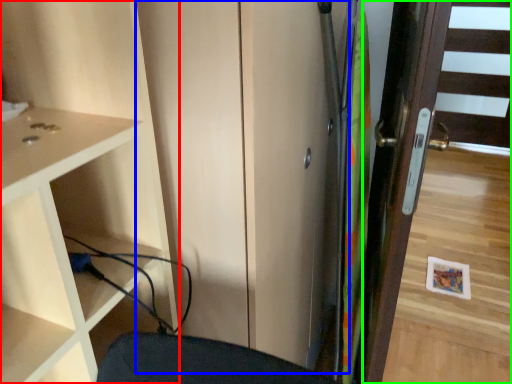
Question: Estimate the real-world distances between objects in this image. Which object is closer to cupboard (highlighted by a red box), screen door (highlighted by a blue box) or door (highlighted by a green box)?

Choices:
 (A) screen door
 (B) door

Answer: (A)